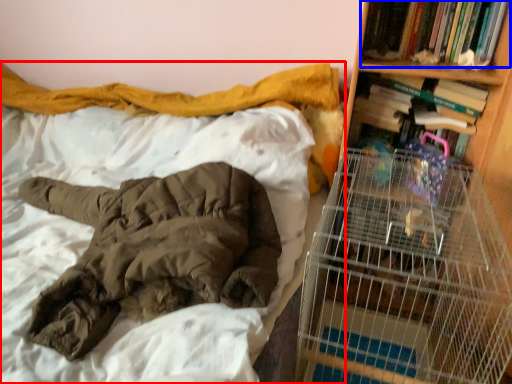
Question: Which of the following is the closest to the observer, bed (highlighted by a red box) or book (highlighted by a blue box)?

Choices:
 (A) bed
 (B) book

Answer: (A)